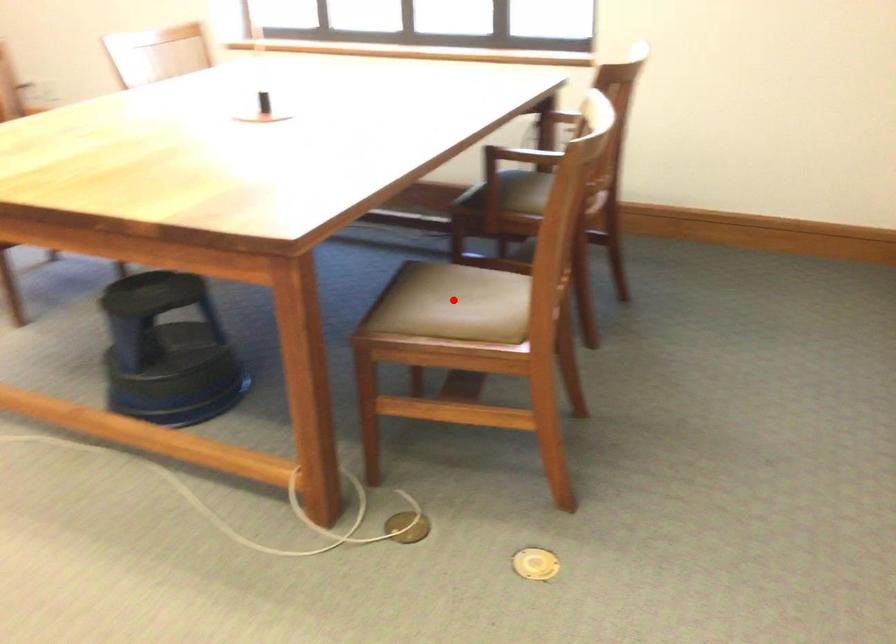
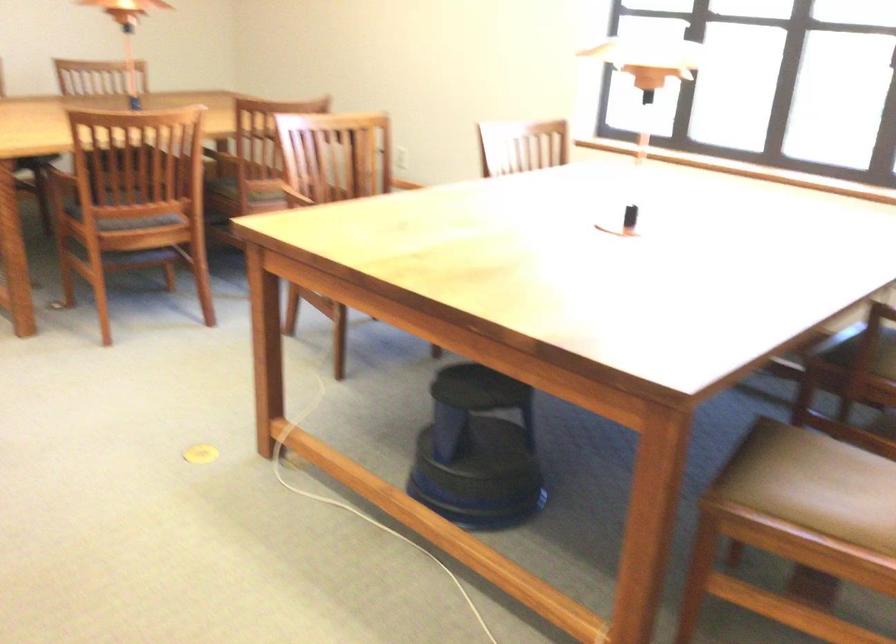
Question: I am providing you with two images of the same scene from different viewpoints. In image1, a red point is highlighted. Considering the same 3D point in image2, which of the following is correct?

Choices:
 (A) It is closer
 (B) It is farther

Answer: (A)